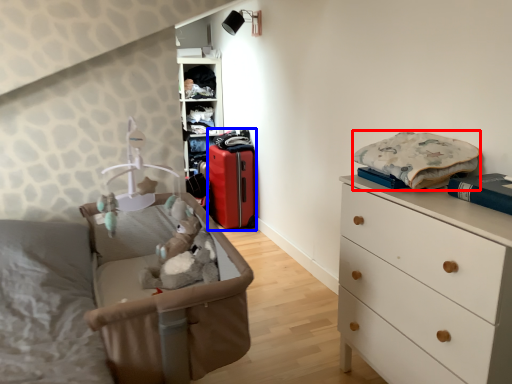
Question: Which point is closer to the camera, clothing (highlighted by a red box) or luggage (highlighted by a blue box)?

Choices:
 (A) clothing
 (B) luggage

Answer: (A)